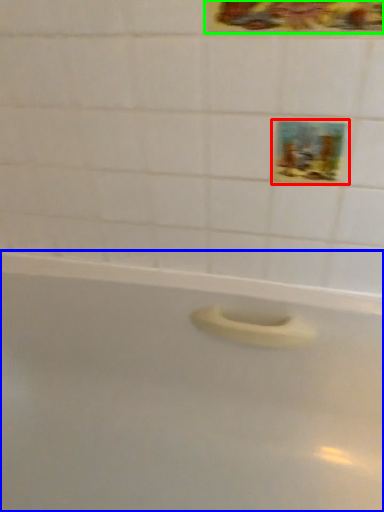
Question: Based on their relative distances, which object is nearer to decorative picture (highlighted by a red box)? Choose from bathtub (highlighted by a blue box) and decorative picture (highlighted by a green box).

Choices:
 (A) bathtub
 (B) decorative picture

Answer: (B)